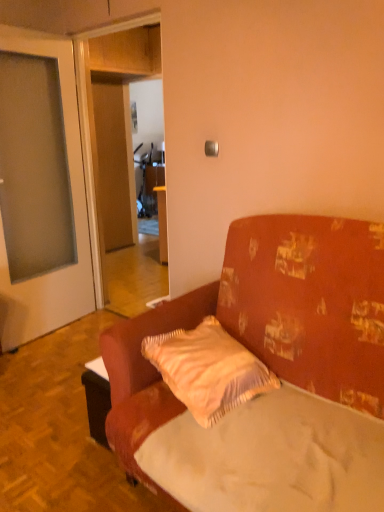
What is the approximate height of textured fabric couch at center?

It is 3.68 feet.

I want to click on light beige textured pillow at center, so click(x=208, y=369).

Which of these two, light beige textured pillow at center or textured fabric couch at center, is wider?

With larger width is textured fabric couch at center.

Does light beige textured pillow at center appear on the right side of textured fabric couch at center?

No, light beige textured pillow at center is not to the right of textured fabric couch at center.

Which of these two, light beige textured pillow at center or textured fabric couch at center, is bigger?

textured fabric couch at center.

How far apart are light beige textured pillow at center and textured fabric couch at center?

A distance of 7.25 inches exists between light beige textured pillow at center and textured fabric couch at center.

Can you tell me how much textured fabric couch at center and white fabric mattress at center differ in facing direction?

There is a 1.5-degree angle between the facing directions of textured fabric couch at center and white fabric mattress at center.

From the image's perspective, who appears lower, textured fabric couch at center or white fabric mattress at center?

From the image's view, white fabric mattress at center is below.

Is textured fabric couch at center taller or shorter than white fabric mattress at center?

In the image, textured fabric couch at center appears to be taller than white fabric mattress at center.

Locate an element on the screen. studio couch in front of the white fabric mattress at center is located at coordinates (273, 371).

From the image's perspective, relative to textured fabric couch at center, is white fabric mattress at center above or below?

Clearly, from the image's perspective, white fabric mattress at center is below textured fabric couch at center.

Can textured fabric couch at center be found inside white fabric mattress at center?

No, textured fabric couch at center is located outside of white fabric mattress at center.

Which is behind, white fabric mattress at center or textured fabric couch at center?

white fabric mattress at center.

Is white fabric mattress at center bigger than textured fabric couch at center?

No, white fabric mattress at center is not bigger than textured fabric couch at center.

Looking at this image, is light beige textured pillow at center turned away from white fabric mattress at center?

No, light beige textured pillow at center is not facing the opposite direction of white fabric mattress at center.

Looking at this image, looking at the image, does light beige textured pillow at center seem bigger or smaller compared to white fabric mattress at center?

In the image, light beige textured pillow at center appears to be smaller than white fabric mattress at center.

Can you confirm if light beige textured pillow at center is thinner than white fabric mattress at center?

Yes.

Which object is positioned more to the right, light beige textured pillow at center or white fabric mattress at center?

white fabric mattress at center is more to the right.

Which of these two, white fabric mattress at center or light beige textured pillow at center, is wider?

white fabric mattress at center is wider.

Based on the photo, does white fabric mattress at center turn towards light beige textured pillow at center?

No, white fabric mattress at center is not facing towards light beige textured pillow at center.

Visually, is white fabric mattress at center positioned to the left or to the right of light beige textured pillow at center?

Based on their positions, white fabric mattress at center is located to the right of light beige textured pillow at center.

From a real-world perspective, is white fabric mattress at center positioned under light beige textured pillow at center based on gravity?

Yes.

Between textured fabric couch at center and light beige textured pillow at center, which one has more height?

With more height is textured fabric couch at center.

Locate an element on the screen. The image size is (384, 512). studio couch in front of the light beige textured pillow at center is located at coordinates (273, 371).

Considering the relative positions of textured fabric couch at center and light beige textured pillow at center in the image provided, is textured fabric couch at center to the left of light beige textured pillow at center from the viewer's perspective?

No.

At what (x,y) coordinates should I click in order to perform the action: click on pillow that is under the textured fabric couch at center (from a real-world perspective). Please return your answer as a coordinate pair (x, y). This screenshot has width=384, height=512. Looking at the image, I should click on (208, 369).

I want to click on studio couch in front of the white fabric mattress at center, so click(273, 371).

From the image, which object appears to be nearer to light beige textured pillow at center, white fabric mattress at center or textured fabric couch at center?

textured fabric couch at center.

Which object lies nearer to the anchor point textured fabric couch at center, white fabric mattress at center or light beige textured pillow at center?

white fabric mattress at center.

From the image, which object appears to be farther from textured fabric couch at center, light beige textured pillow at center or white fabric mattress at center?

Among the two, light beige textured pillow at center is located further to textured fabric couch at center.

Which object lies further to the anchor point white fabric mattress at center, textured fabric couch at center or light beige textured pillow at center?

light beige textured pillow at center is further to white fabric mattress at center.

From the image, which object appears to be farther from light beige textured pillow at center, textured fabric couch at center or white fabric mattress at center?

white fabric mattress at center.

Estimate the real-world distances between objects in this image. Which object is closer to white fabric mattress at center, light beige textured pillow at center or textured fabric couch at center?

Based on the image, textured fabric couch at center appears to be nearer to white fabric mattress at center.

Locate an element on the screen. mattress located between textured fabric couch at center and light beige textured pillow at center in the depth direction is located at coordinates (271, 457).